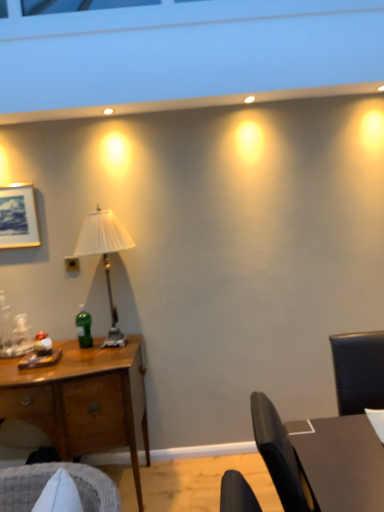
Question: Is green glass bottle at center-left to the left of white pleated fabric lampshade at left from the viewer's perspective?

Choices:
 (A) yes
 (B) no

Answer: (A)

Question: Does green glass bottle at center-left come behind white pleated fabric lampshade at left?

Choices:
 (A) no
 (B) yes

Answer: (B)

Question: Considering the relative sizes of green glass bottle at center-left and white pleated fabric lampshade at left in the image provided, is green glass bottle at center-left taller than white pleated fabric lampshade at left?

Choices:
 (A) yes
 (B) no

Answer: (B)

Question: Considering the relative sizes of green glass bottle at center-left and white pleated fabric lampshade at left in the image provided, is green glass bottle at center-left bigger than white pleated fabric lampshade at left?

Choices:
 (A) no
 (B) yes

Answer: (A)

Question: Considering the relative sizes of green glass bottle at center-left and white pleated fabric lampshade at left in the image provided, is green glass bottle at center-left shorter than white pleated fabric lampshade at left?

Choices:
 (A) yes
 (B) no

Answer: (A)

Question: Considering the positions of point (72, 266) and point (134, 352), is point (72, 266) closer or farther from the camera than point (134, 352)?

Choices:
 (A) closer
 (B) farther

Answer: (B)

Question: Is black plastic power outlet at center spatially inside wooden desk at left, or outside of it?

Choices:
 (A) outside
 (B) inside

Answer: (A)

Question: Is black plastic power outlet at center taller or shorter than wooden desk at left?

Choices:
 (A) tall
 (B) short

Answer: (B)

Question: Considering their positions, is black plastic power outlet at center located in front of or behind wooden desk at left?

Choices:
 (A) behind
 (B) front

Answer: (A)

Question: From a real-world perspective, is dark brown wooden table at right positioned above or below wooden desk at left?

Choices:
 (A) below
 (B) above

Answer: (B)

Question: Visually, is dark brown wooden table at right positioned to the left or to the right of wooden desk at left?

Choices:
 (A) right
 (B) left

Answer: (A)

Question: Looking at the image, does dark brown wooden table at right seem bigger or smaller compared to wooden desk at left?

Choices:
 (A) big
 (B) small

Answer: (B)

Question: Choose the correct answer: Is dark brown wooden table at right inside wooden desk at left or outside it?

Choices:
 (A) outside
 (B) inside

Answer: (A)

Question: Based on their positions, is green glass bottle at center-left located to the left or right of dark brown wooden table at right?

Choices:
 (A) left
 (B) right

Answer: (A)

Question: Is green glass bottle at center-left bigger or smaller than dark brown wooden table at right?

Choices:
 (A) big
 (B) small

Answer: (B)